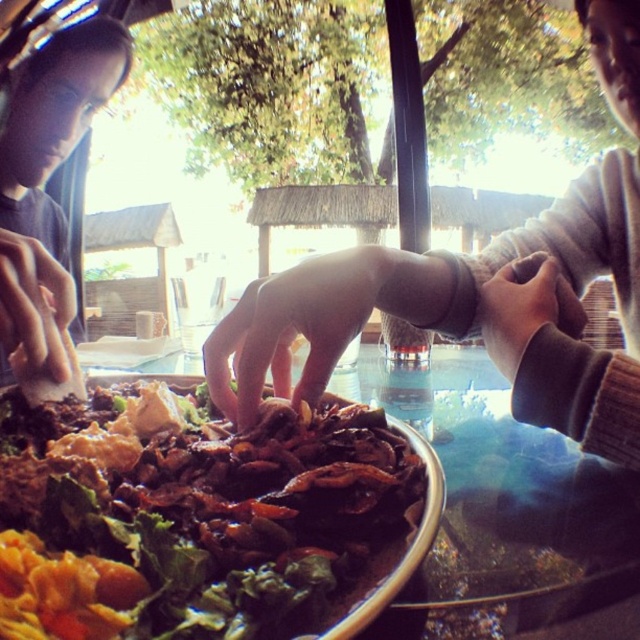
Question: Based on their relative distances, which object is nearer to the shiny brown salad at center?

Choices:
 (A) brown fuzzy sweater at upper right
 (B) pink matte hand at center

Answer: (B)

Question: Which point is closer to the camera?

Choices:
 (A) smooth beige hand at center
 (B) brown fuzzy sweater at upper right

Answer: (A)

Question: Which is nearer to the matte black hair at upper left?

Choices:
 (A) matte white hand at lower left
 (B) pink matte hand at center

Answer: (A)

Question: Is shiny brown salad at center closer to the viewer compared to smooth beige hand at center?

Choices:
 (A) yes
 (B) no

Answer: (A)

Question: Is pink matte hand at center below matte black hair at upper left?

Choices:
 (A) no
 (B) yes

Answer: (B)

Question: Does smooth beige hand at center appear over pink matte hand at center?

Choices:
 (A) yes
 (B) no

Answer: (A)